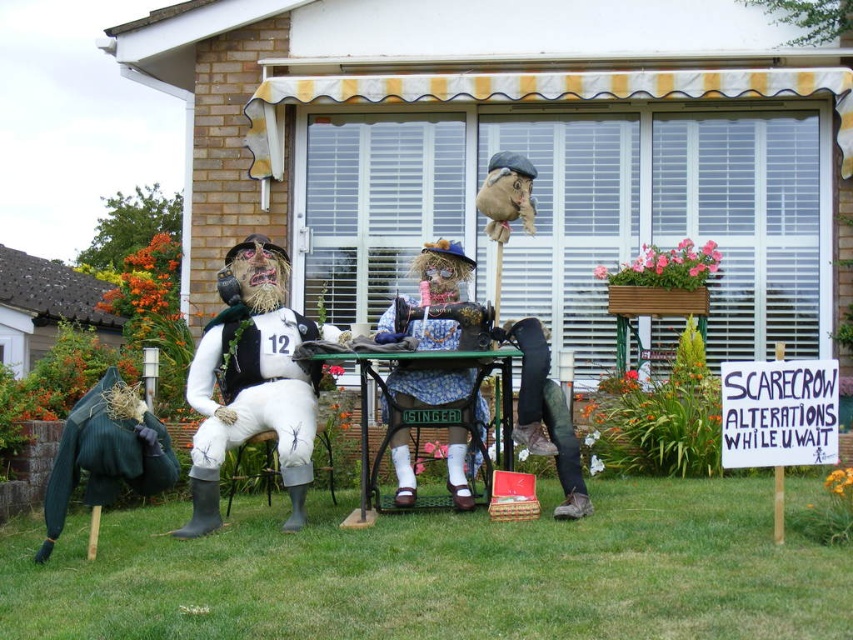
Between matte white rubber boots at left and green metal table at center, which one is positioned lower?

Positioned lower is green metal table at center.

Between point (248, 392) and point (397, 410), which one is positioned behind?

The point (248, 392) is behind.

The width and height of the screenshot is (853, 640). In order to click on matte white rubber boots at left in this screenshot , I will do `click(253, 380)`.

In the scene shown: Who is lower down, green grass at lower center or green metal table at center?

green grass at lower center is below.

Is green grass at lower center in front of green metal table at center?

Yes, it is in front of green metal table at center.

Is point (804, 554) farther from camera compared to point (395, 429)?

No, it is not.

Where is `green grass at lower center`? Image resolution: width=853 pixels, height=640 pixels. green grass at lower center is located at coordinates (440, 573).

Does white fabric scarecrow at center have a larger size compared to blue floral fabric at center?

Actually, white fabric scarecrow at center might be smaller than blue floral fabric at center.

Who is lower down, white fabric scarecrow at center or blue floral fabric at center?

white fabric scarecrow at center is below.

Is point (268, 426) more distant than point (421, 321)?

No, it is not.

Find the location of a particular element. Image resolution: width=853 pixels, height=640 pixels. white fabric scarecrow at center is located at coordinates (254, 394).